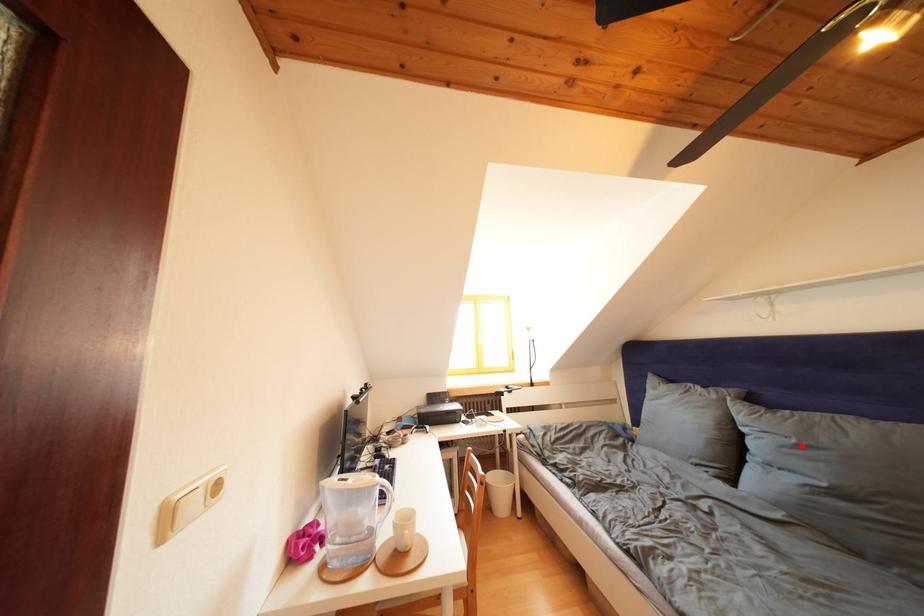
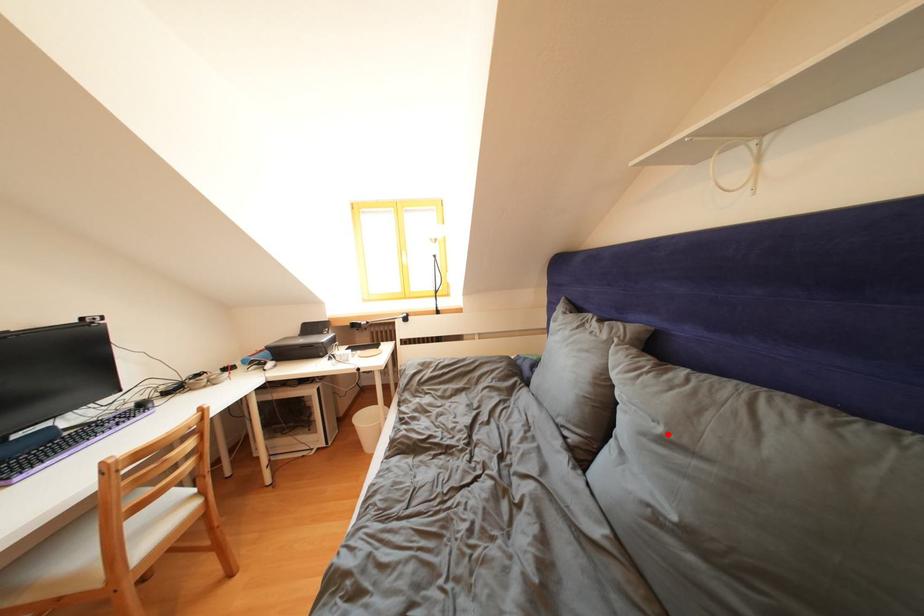
I am providing you with two images of the same scene from different viewpoints. A red point is marked on the first image and another point is marked on the second image. Is the red point in image1 aligned with the point shown in image2?

Yes